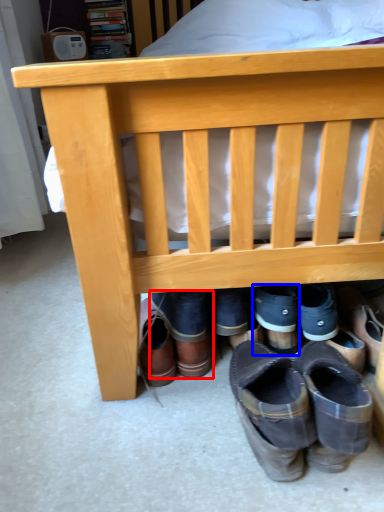
Question: Which of the following is the closest to the observer, footwear (highlighted by a red box) or footwear (highlighted by a blue box)?

Choices:
 (A) footwear
 (B) footwear

Answer: (A)